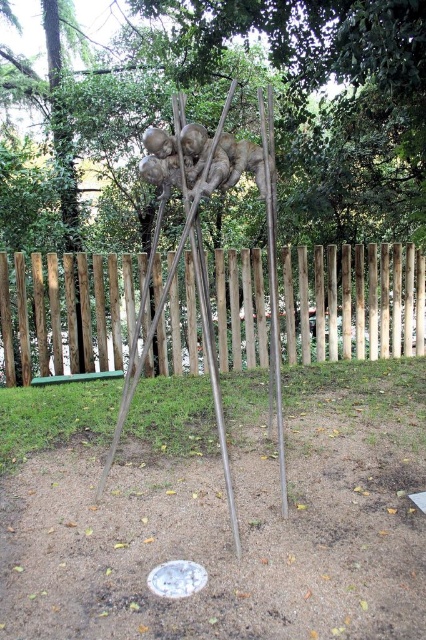
Question: Does brushed metal tripod at center appear on the right side of polished bronze sculpture at center?

Choices:
 (A) yes
 (B) no

Answer: (B)

Question: Where is brushed metal sculpture at center located in relation to polished bronze sculpture at center in the image?

Choices:
 (A) above
 (B) below

Answer: (A)

Question: Can you confirm if polished bronze sculpture at center is bigger than metallic polished pole at center?

Choices:
 (A) yes
 (B) no

Answer: (A)

Question: Among these objects, which one is nearest to the camera?

Choices:
 (A) polished bronze sculpture at center
 (B) metallic polished pole at center
 (C) wooden fence at center

Answer: (A)

Question: Based on their relative distances, which object is farther from the wooden fence at center?

Choices:
 (A) brushed metal tripod at center
 (B) metallic polished pole at center
 (C) polished bronze sculpture at center
 (D) brushed metal sculpture at center

Answer: (C)

Question: Based on their relative distances, which object is nearer to the wooden fence at center?

Choices:
 (A) polished bronze sculpture at center
 (B) brushed metal sculpture at center

Answer: (B)